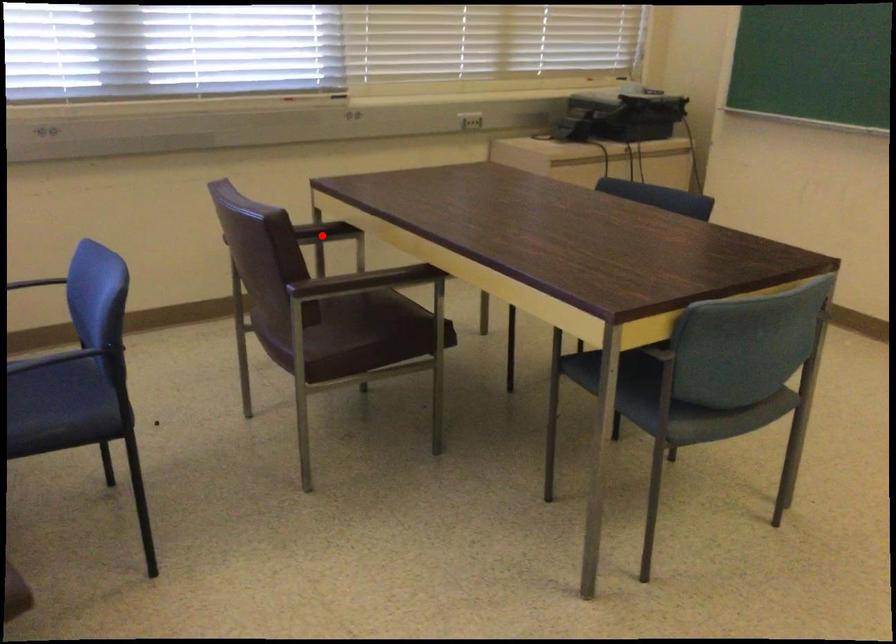
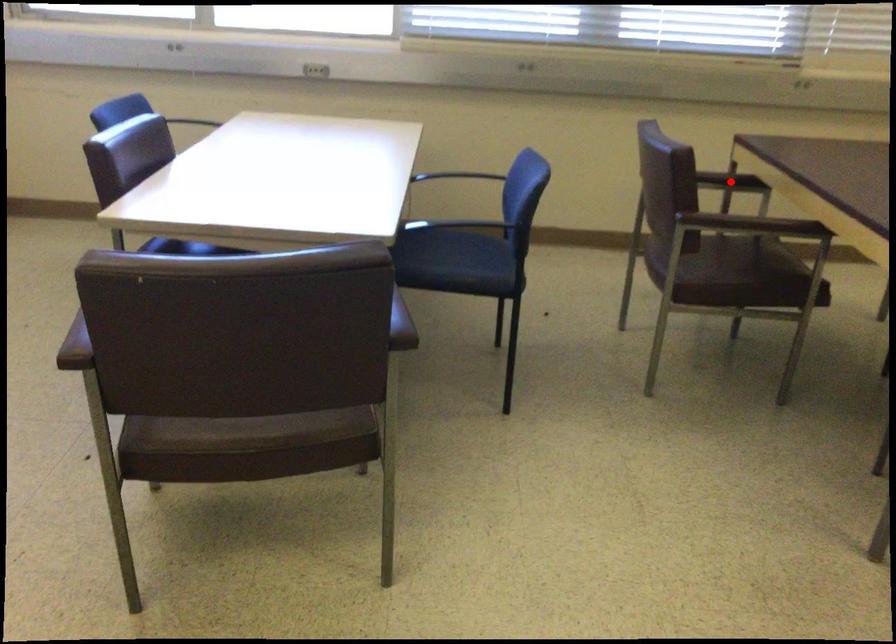
I am providing you with two images of the same scene from different viewpoints. A red point is marked on the first image and another point is marked on the second image. Is the red point in image1 aligned with the point shown in image2?

Yes